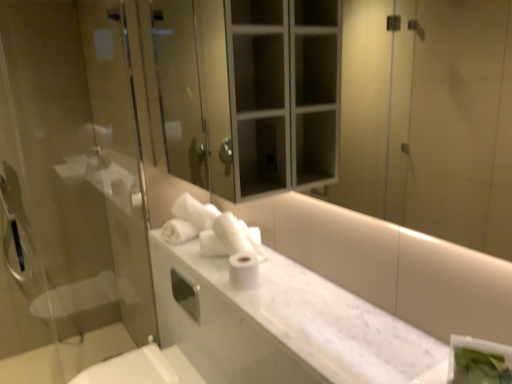
Question: From a real-world perspective, is white glossy mirror at upper center positioned under white marble counter top at center based on gravity?

Choices:
 (A) yes
 (B) no

Answer: (B)

Question: Considering the relative sizes of white glossy mirror at upper center and white marble counter top at center in the image provided, is white glossy mirror at upper center shorter than white marble counter top at center?

Choices:
 (A) no
 (B) yes

Answer: (A)

Question: Does white glossy mirror at upper center appear on the left side of white marble counter top at center?

Choices:
 (A) yes
 (B) no

Answer: (B)

Question: Does white glossy mirror at upper center have a smaller size compared to white marble counter top at center?

Choices:
 (A) yes
 (B) no

Answer: (B)

Question: From the image's perspective, is white glossy mirror at upper center below white marble counter top at center?

Choices:
 (A) no
 (B) yes

Answer: (A)

Question: From a real-world perspective, relative to white glossy mirror at upper center, is transparent glass screen door at left vertically above or below?

Choices:
 (A) above
 (B) below

Answer: (B)

Question: In terms of height, does transparent glass screen door at left look taller or shorter compared to white glossy mirror at upper center?

Choices:
 (A) tall
 (B) short

Answer: (A)

Question: Is transparent glass screen door at left to the left or to the right of white glossy mirror at upper center in the image?

Choices:
 (A) right
 (B) left

Answer: (B)

Question: Is transparent glass screen door at left in front of or behind white glossy mirror at upper center in the image?

Choices:
 (A) behind
 (B) front

Answer: (A)

Question: From a real-world perspective, relative to white glossy mirror at upper center, is white matte toilet paper at center vertically above or below?

Choices:
 (A) above
 (B) below

Answer: (B)

Question: Relative to white glossy mirror at upper center, is white matte toilet paper at center in front or behind?

Choices:
 (A) behind
 (B) front

Answer: (A)

Question: Considering the relative positions of white matte toilet paper at center and white glossy mirror at upper center in the image provided, is white matte toilet paper at center to the left or to the right of white glossy mirror at upper center?

Choices:
 (A) left
 (B) right

Answer: (A)

Question: Looking at the image, does white matte toilet paper at center seem bigger or smaller compared to white glossy mirror at upper center?

Choices:
 (A) small
 (B) big

Answer: (A)

Question: Is white glossy mirror at upper center to the left or to the right of white matte toilet paper at center in the image?

Choices:
 (A) right
 (B) left

Answer: (A)

Question: In terms of width, does white glossy mirror at upper center look wider or thinner when compared to white matte toilet paper at center?

Choices:
 (A) wide
 (B) thin

Answer: (B)